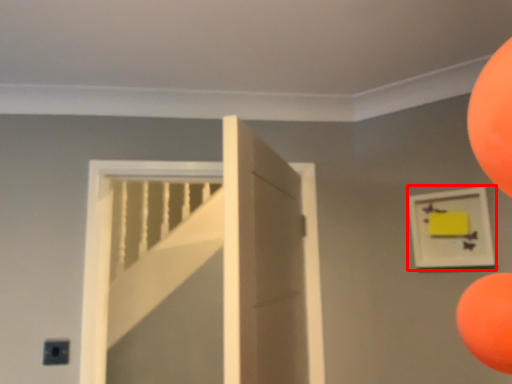
Question: From the image's perspective, where is picture frame (annotated by the red box) located relative to door?

Choices:
 (A) above
 (B) below

Answer: (A)